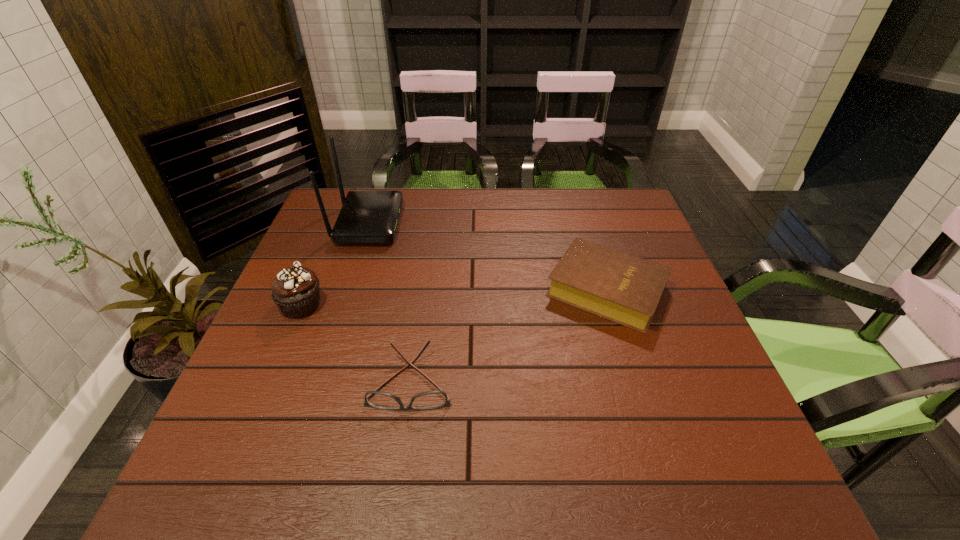
Identify the location of router. (367, 217).

Identify the location of the tallest object. (367, 217).

You are a GUI agent. You are given a task and a screenshot of the screen. Output one action in this format:
    pyautogui.click(x=<x>, y=<y>)
    Task: Click on the cupcake
    This screenshot has width=960, height=540.
    Given the screenshot: What is the action you would take?
    pyautogui.click(x=295, y=291)

Image resolution: width=960 pixels, height=540 pixels. Identify the location of the rightmost object. (625, 289).

At what (x,y) coordinates should I click in order to perform the action: click on the second shortest object. Please return your answer as a coordinate pair (x, y). The width and height of the screenshot is (960, 540). Looking at the image, I should click on (625, 289).

Identify the location of the shortest object. tap(427, 400).

I want to click on spectacles, so click(x=427, y=400).

Image resolution: width=960 pixels, height=540 pixels. Find the location of `free region located 0.360m on the front-facing side of the farthest object`. free region located 0.360m on the front-facing side of the farthest object is located at coordinates (517, 223).

Where is `free spot located 0.360m on the right of the second tallest object`? free spot located 0.360m on the right of the second tallest object is located at coordinates (469, 306).

You are a GUI agent. You are given a task and a screenshot of the screen. Output one action in this format:
    pyautogui.click(x=<x>, y=<y>)
    Task: Click on the blank area located on the left of the third tallest object
    The width and height of the screenshot is (960, 540).
    Given the screenshot: What is the action you would take?
    pyautogui.click(x=444, y=290)